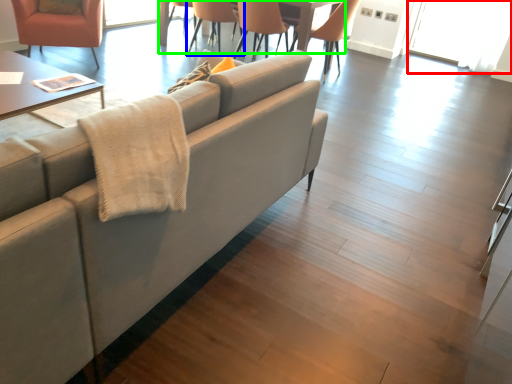
Question: Which object is the farthest from glass door (highlighted by a red box)? Choose among these: chair (highlighted by a blue box) or table (highlighted by a green box).

Choices:
 (A) chair
 (B) table

Answer: (A)